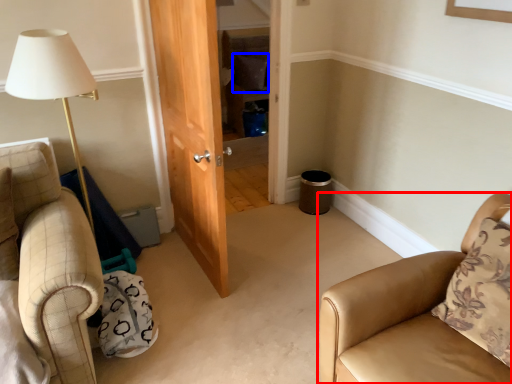
Question: Which point is closer to the camera, chair (highlighted by a red box) or pillow (highlighted by a blue box)?

Choices:
 (A) chair
 (B) pillow

Answer: (A)